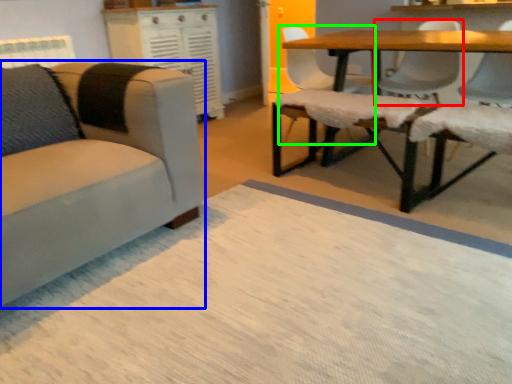
Question: Which object is positioned farthest from chair (highlighted by a red box)? Select from chair (highlighted by a blue box) and chair (highlighted by a green box).

Choices:
 (A) chair
 (B) chair

Answer: (A)